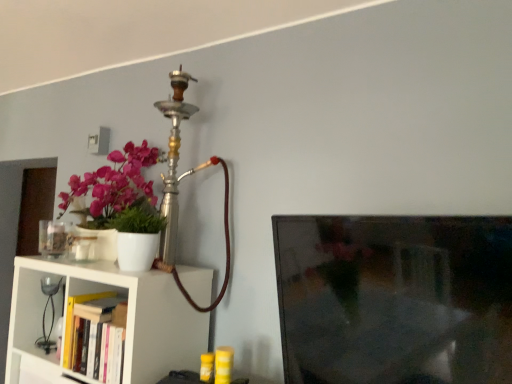
Question: Would you say black glass table lamp at left is part of hardcover book at lower left's contents?

Choices:
 (A) no
 (B) yes

Answer: (A)

Question: Considering the relative sizes of hardcover book at lower left and black glass table lamp at left in the image provided, is hardcover book at lower left shorter than black glass table lamp at left?

Choices:
 (A) yes
 (B) no

Answer: (A)

Question: Is hardcover book at lower left to the left of black glass table lamp at left from the viewer's perspective?

Choices:
 (A) yes
 (B) no

Answer: (B)

Question: Does hardcover book at lower left come in front of black glass table lamp at left?

Choices:
 (A) yes
 (B) no

Answer: (A)

Question: Can you confirm if hardcover book at lower left is bigger than black glass table lamp at left?

Choices:
 (A) no
 (B) yes

Answer: (A)

Question: From a real-world perspective, is hardcover book at lower left below black glass table lamp at left?

Choices:
 (A) no
 (B) yes

Answer: (B)

Question: Is hardcover book at lower left further to the viewer compared to white matte shelf at lower left?

Choices:
 (A) no
 (B) yes

Answer: (B)

Question: Is hardcover book at lower left placed right next to white matte shelf at lower left?

Choices:
 (A) no
 (B) yes

Answer: (A)

Question: Is hardcover book at lower left at the left side of white matte shelf at lower left?

Choices:
 (A) yes
 (B) no

Answer: (A)

Question: Does hardcover book at lower left have a greater width compared to white matte shelf at lower left?

Choices:
 (A) no
 (B) yes

Answer: (A)

Question: Is hardcover book at lower left not inside white matte shelf at lower left?

Choices:
 (A) no
 (B) yes

Answer: (A)

Question: Is hardcover book at lower left positioned with its back to white matte shelf at lower left?

Choices:
 (A) yes
 (B) no

Answer: (A)

Question: Does white matte shelf at lower left appear on the right side of hardcover book at lower left?

Choices:
 (A) yes
 (B) no

Answer: (A)